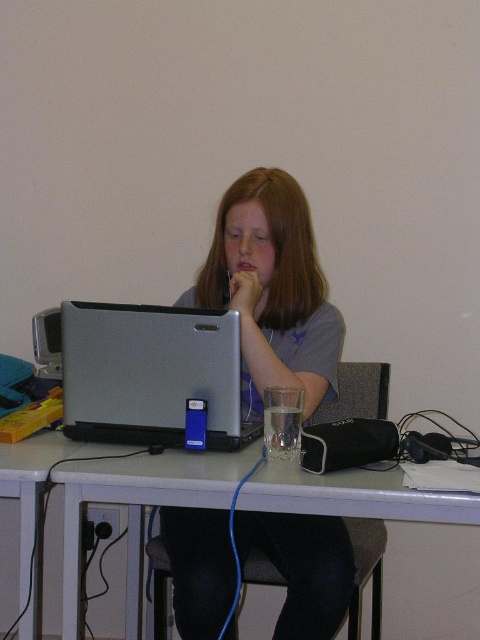
Question: Which object is the farthest from the matte gray laptop at center?

Choices:
 (A) white glossy computer desk at center
 (B) silver metallic laptop at center

Answer: (A)

Question: Does white glossy computer desk at center appear under silver metallic laptop at center?

Choices:
 (A) yes
 (B) no

Answer: (A)

Question: Among these objects, which one is farthest from the camera?

Choices:
 (A) silver metallic laptop at center
 (B) matte gray laptop at center

Answer: (B)

Question: Among these objects, which one is farthest from the camera?

Choices:
 (A) silver metallic laptop at center
 (B) white glossy computer desk at center

Answer: (A)

Question: Can you confirm if white glossy computer desk at center is positioned above silver metallic laptop at center?

Choices:
 (A) yes
 (B) no

Answer: (B)

Question: Is matte gray laptop at center positioned behind silver metallic laptop at center?

Choices:
 (A) yes
 (B) no

Answer: (A)